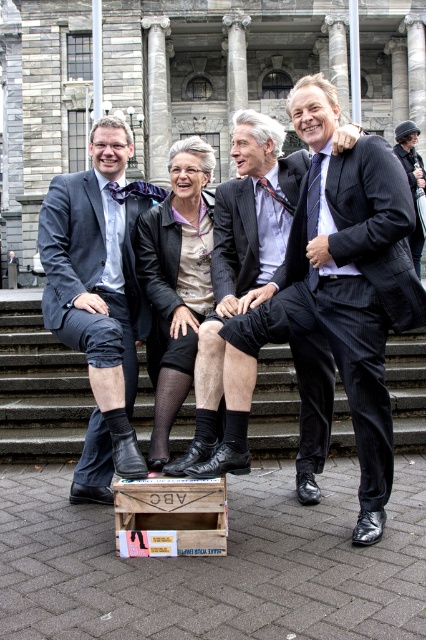
You are a photographer adjusting your camera settings. You notice the matte black suit at center and the silk tie at right. Which object is closer to the camera? Please explain your reasoning based on their positions in the scene.

The matte black suit at center is closer to the camera because it is positioned in front of the silk tie at right, meaning the silk tie at right is behind it in the scene.

You are a photographer trying to capture a group photo of the dark blue suit at center and the black leather shoes at lower center. Since you want to ensure both are in focus, you need to know which object is taller. Can you tell me which one is taller?

The dark blue suit at center is much taller than the black leather shoes at lower center.